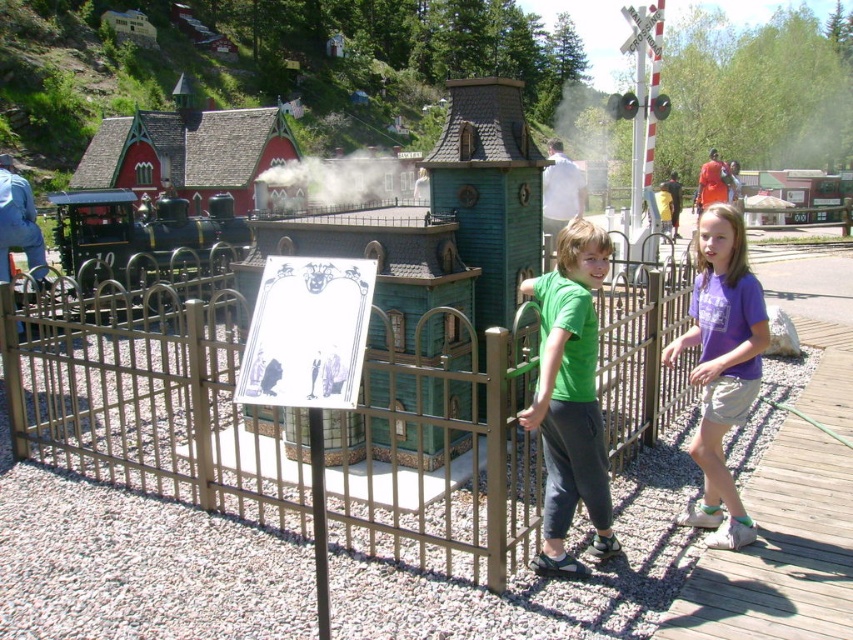
Question: Which point is closer to the camera taking this photo?

Choices:
 (A) (697, 310)
 (B) (32, 416)
 (C) (149, 230)

Answer: (A)

Question: Is brown metal fence at center positioned before white smoke at center?

Choices:
 (A) yes
 (B) no

Answer: (B)

Question: Based on their relative distances, which object is nearer to the white smoke at center?

Choices:
 (A) green matte shirt at center
 (B) brown metal fence at center

Answer: (A)

Question: Which object is the farthest from the shiny black locomotive at left?

Choices:
 (A) white smoke at center
 (B) brown metal fence at center
 (C) purple cotton shirt at right

Answer: (A)

Question: Can you confirm if green matte shirt at center is positioned above white smoke at center?

Choices:
 (A) yes
 (B) no

Answer: (B)

Question: Is green matte shirt at center bigger than purple cotton shirt at right?

Choices:
 (A) no
 (B) yes

Answer: (B)